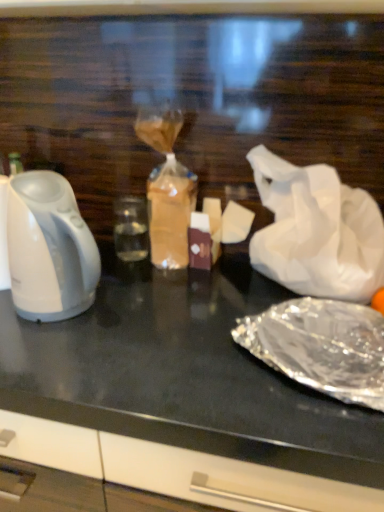
In order to click on free space to the back side of white glossy kettle at left in this screenshot , I will do `click(117, 272)`.